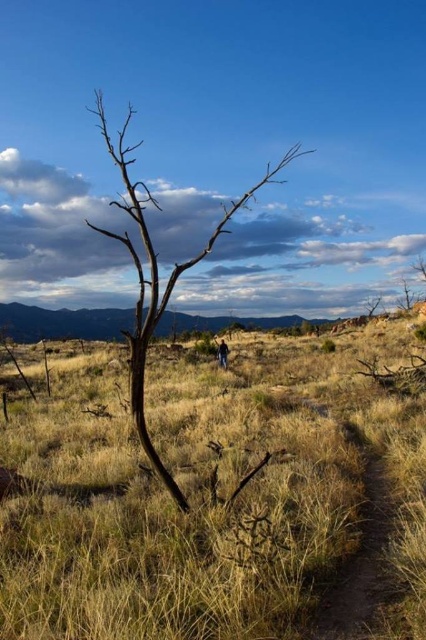
Question: Is brown matte tree at center further to camera compared to brown dirt path at lower right?

Choices:
 (A) yes
 (B) no

Answer: (A)

Question: Does brown dry grass at center have a larger size compared to brown matte tree at center?

Choices:
 (A) yes
 (B) no

Answer: (B)

Question: Among these objects, which one is farthest from the camera?

Choices:
 (A) brown dry grass at center
 (B) brown dirt path at lower right

Answer: (B)

Question: Which point is farther to the camera?

Choices:
 (A) (95, 605)
 (B) (138, 310)

Answer: (B)

Question: Which is farther from the brown dirt path at lower right?

Choices:
 (A) brown matte tree at center
 (B) brown dry grass at center

Answer: (A)

Question: Is brown matte tree at center to the left of brown dirt path at lower right from the viewer's perspective?

Choices:
 (A) no
 (B) yes

Answer: (B)